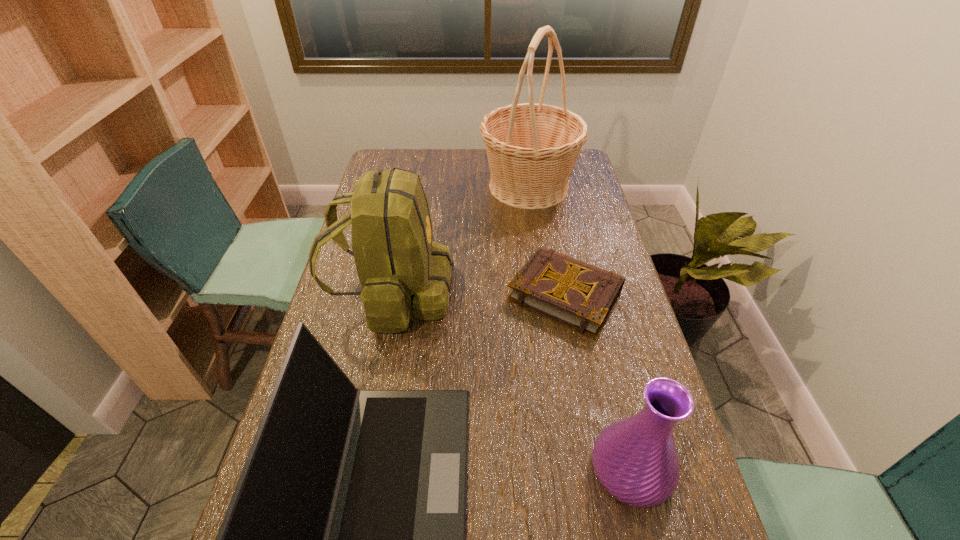
Locate an element on the screen. The height and width of the screenshot is (540, 960). vacant area that lies between the vase and the second tallest object is located at coordinates (512, 381).

Identify the location of vacant area between the backpack and the shortest object. The height and width of the screenshot is (540, 960). (479, 294).

Where is `vacant region between the backpack and the shortest object`? This screenshot has width=960, height=540. vacant region between the backpack and the shortest object is located at coordinates (479, 294).

Locate which object is the second closest to the hardback book. Please provide its 2D coordinates. Your answer should be formatted as a tuple, i.e. [(x, y)], where the tuple contains the x and y coordinates of a point satisfying the conditions above.

[(345, 538)]

The width and height of the screenshot is (960, 540). What are the coordinates of `the closest object relative to the farthest object` in the screenshot? It's located at (403, 273).

Where is `free location that satisfies the following two spatial constraints: 1. on the front-facing side of the vase; 2. on the right side of the backpack`? This screenshot has width=960, height=540. free location that satisfies the following two spatial constraints: 1. on the front-facing side of the vase; 2. on the right side of the backpack is located at coordinates (358, 469).

You are a GUI agent. You are given a task and a screenshot of the screen. Output one action in this format:
    pyautogui.click(x=<x>, y=<y>)
    Task: Click on the vacant space that satisfies the following two spatial constraints: 1. on the front-facing side of the vase; 2. on the right side of the backpack
    This screenshot has height=540, width=960.
    Given the screenshot: What is the action you would take?
    pyautogui.click(x=358, y=469)

Identify the location of free location that satisfies the following two spatial constraints: 1. on the front-facing side of the hardback book; 2. on the right side of the second tallest object. The height and width of the screenshot is (540, 960). (393, 294).

Locate an element on the screen. This screenshot has width=960, height=540. vacant space that satisfies the following two spatial constraints: 1. on the front-facing side of the fourth shortest object; 2. on the back side of the shortest object is located at coordinates (393, 294).